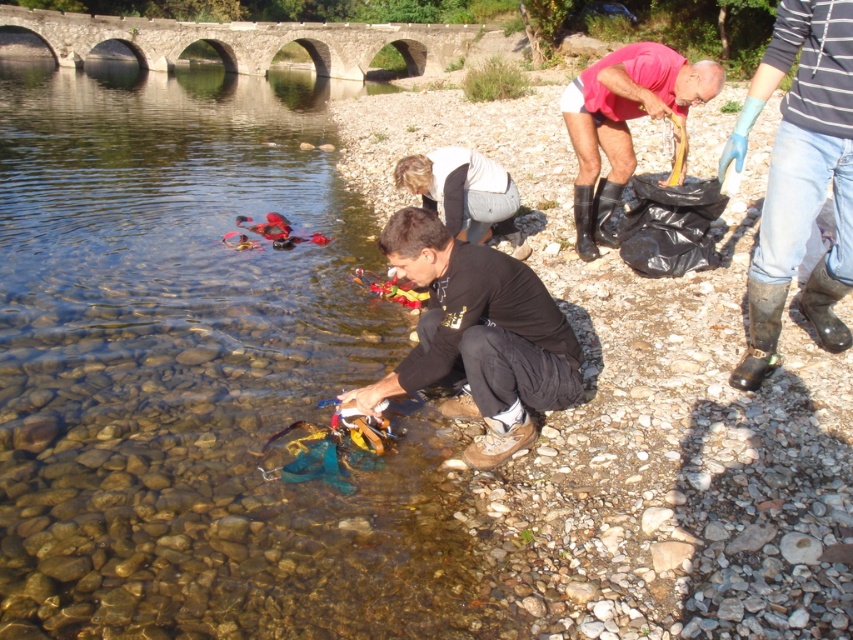
Is black matte clothing at center positioned behind white matte shirt at center?

No, it is in front of white matte shirt at center.

Describe the element at coordinates (479, 336) in the screenshot. The image size is (853, 640). I see `black matte clothing at center` at that location.

You are a GUI agent. You are given a task and a screenshot of the screen. Output one action in this format:
    pyautogui.click(x=<x>, y=<y>)
    Task: Click on the black matte clothing at center
    
    Given the screenshot: What is the action you would take?
    pyautogui.click(x=479, y=336)

Which is more to the left, rubber boots at right or white matte shirt at center?

white matte shirt at center

Is the position of rubber boots at right more distant than that of white matte shirt at center?

Yes, rubber boots at right is behind white matte shirt at center.

I want to click on rubber boots at right, so click(624, 122).

This screenshot has height=640, width=853. I want to click on rubber boots at right, so click(624, 122).

Can you confirm if clear stone creek at center is taller than rubber boots at right?

Indeed, clear stone creek at center has a greater height compared to rubber boots at right.

Is clear stone creek at center bigger than rubber boots at right?

Correct, clear stone creek at center is larger in size than rubber boots at right.

Which is in front, point (107, 410) or point (606, 189)?

Point (107, 410) is in front.

I want to click on clear stone creek at center, so click(200, 376).